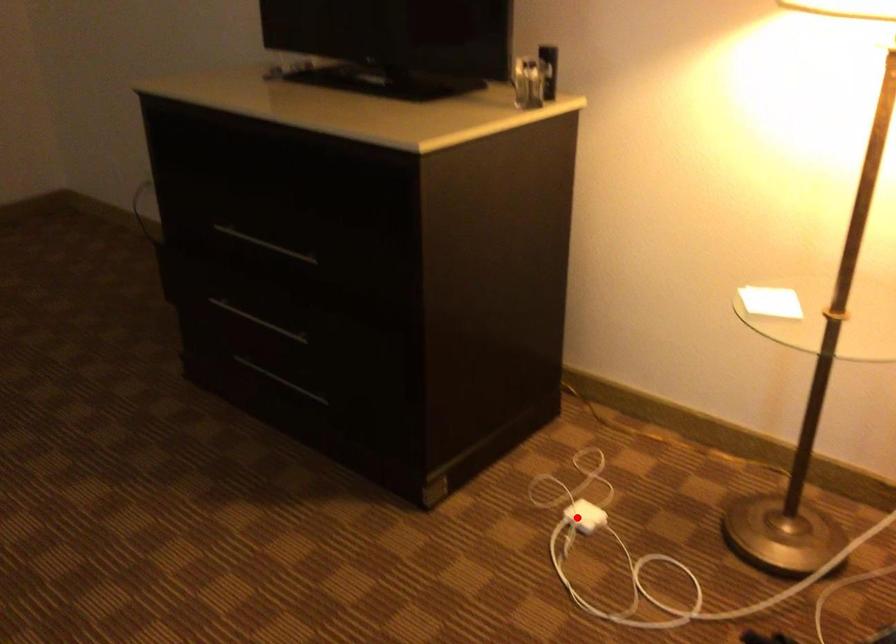
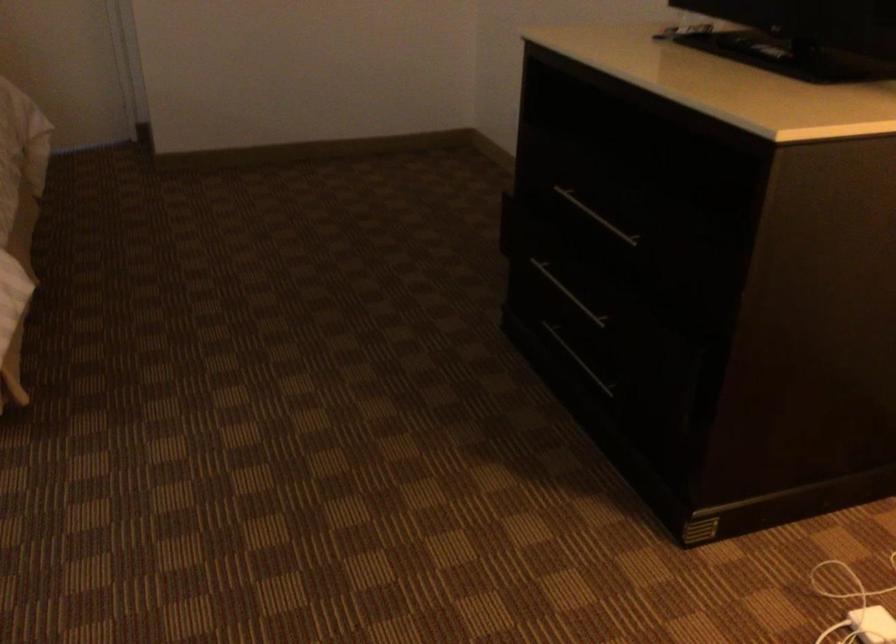
Question: I am providing you with two images of the same scene from different viewpoints. Image1 has a red point marked. In image2, the corresponding 3D location appears at what relative position? Reply with the corresponding letter.

Choices:
 (A) Closer
 (B) Farther

Answer: (A)